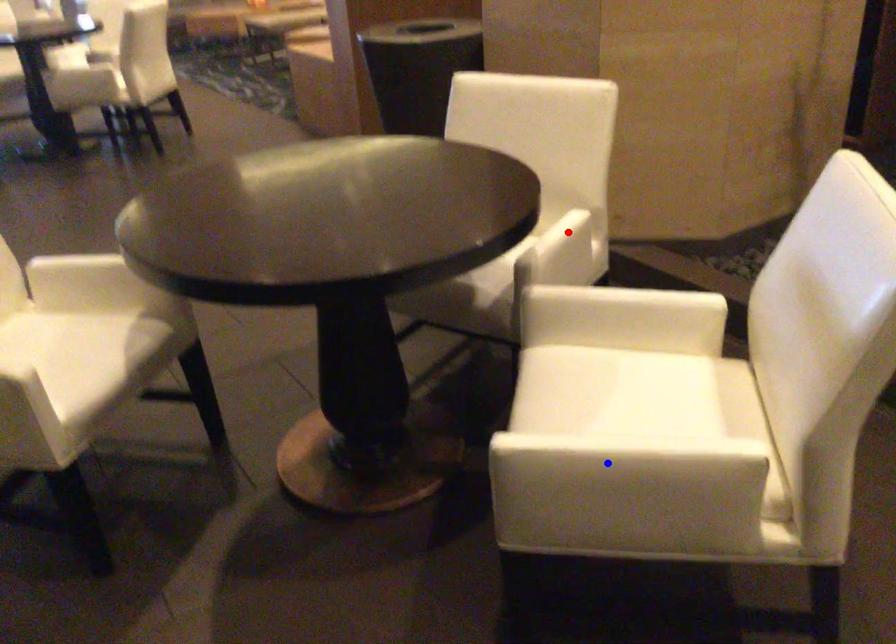
Question: In the image, two points are highlighted. Which point is nearer to the camera? Reply with the corresponding letter.

Choices:
 (A) blue point
 (B) red point

Answer: (A)